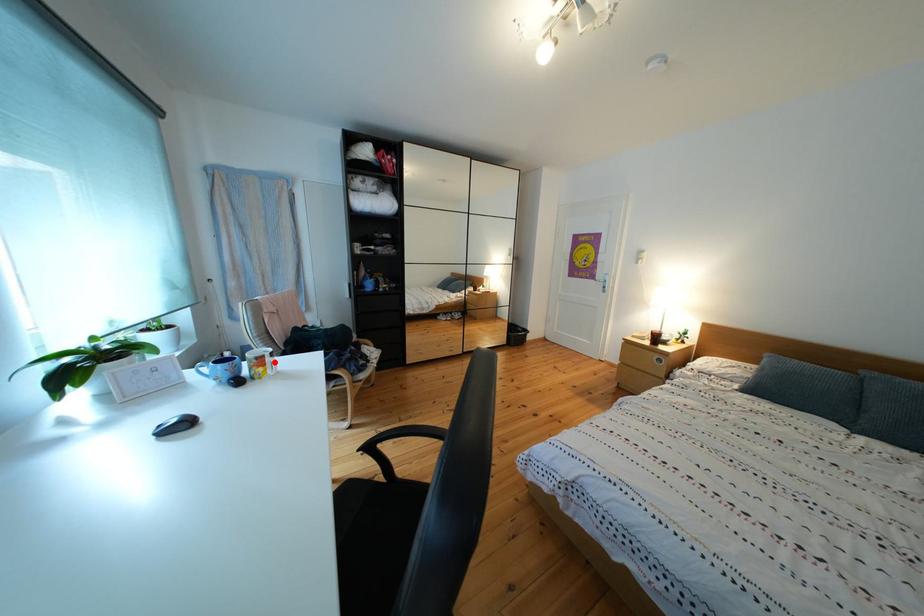
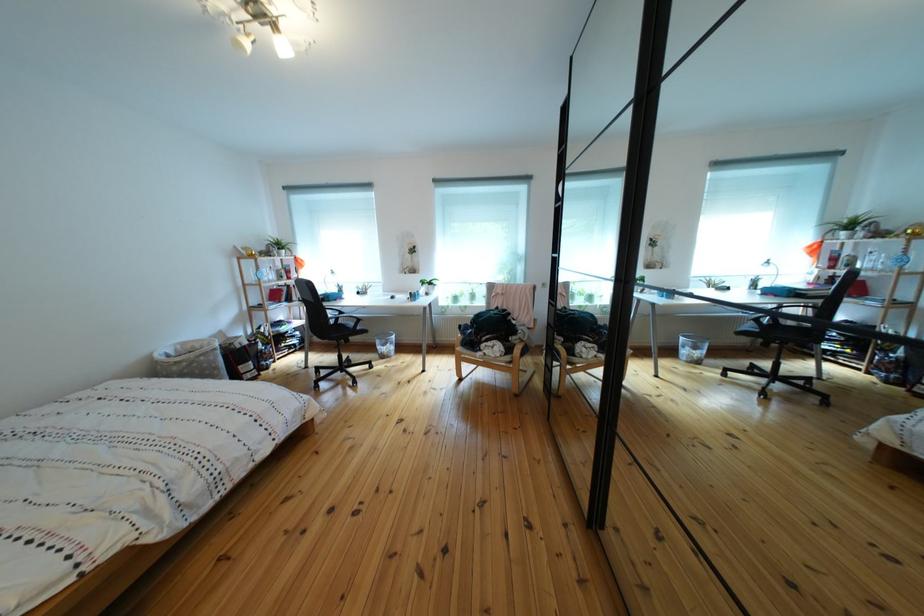
Question: I am providing you with two images of the same scene from different viewpoints. A red point is marked on the first image. At the location where the point appears in image 1, is it still visible in image 2?

Choices:
 (A) Yes
 (B) No

Answer: (B)